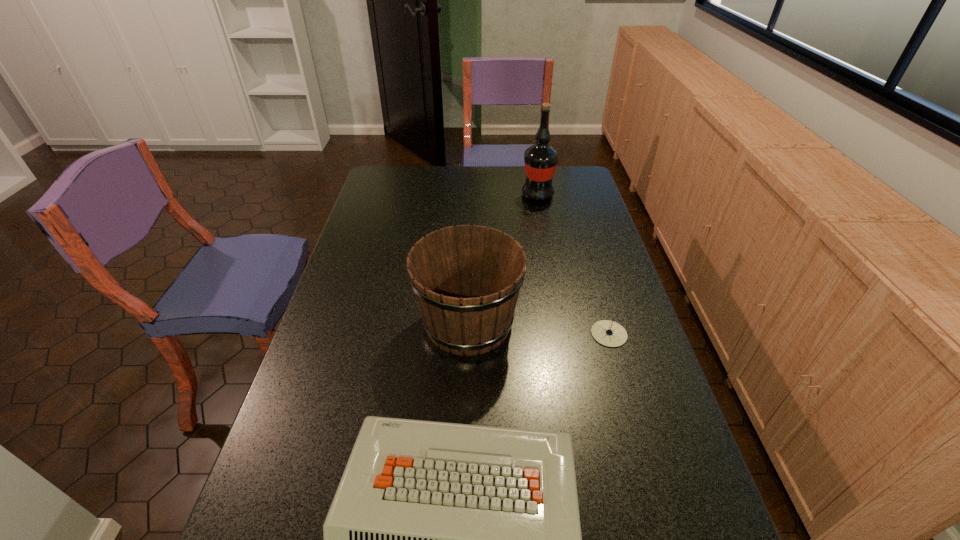
Locate an element on the screen. The image size is (960, 540). free space that satisfies the following two spatial constraints: 1. on the back side of the wine bucket; 2. on the right side of the farthest object is located at coordinates (471, 195).

Where is `free location that satisfies the following two spatial constraints: 1. on the back side of the second tallest object; 2. on the left side of the tallest object`? This screenshot has width=960, height=540. free location that satisfies the following two spatial constraints: 1. on the back side of the second tallest object; 2. on the left side of the tallest object is located at coordinates (471, 195).

The width and height of the screenshot is (960, 540). Identify the location of free space that satisfies the following two spatial constraints: 1. on the front side of the compass; 2. on the right side of the wine bucket. point(468,334).